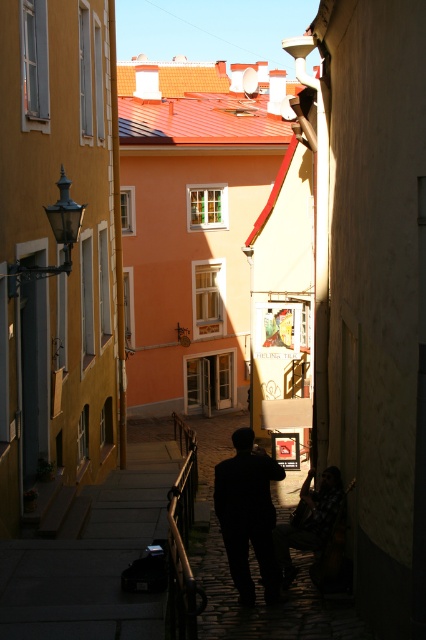
Measure the distance between silhouette dark clothing at center and dark fabric jacket at center.

25.10 inches

Is silhouette dark clothing at center thinner than dark fabric jacket at center?

Yes.

Is point (259, 458) in front of point (301, 545)?

Yes, point (259, 458) is closer to viewer.

Locate an element on the screen. The width and height of the screenshot is (426, 640). silhouette dark clothing at center is located at coordinates (247, 515).